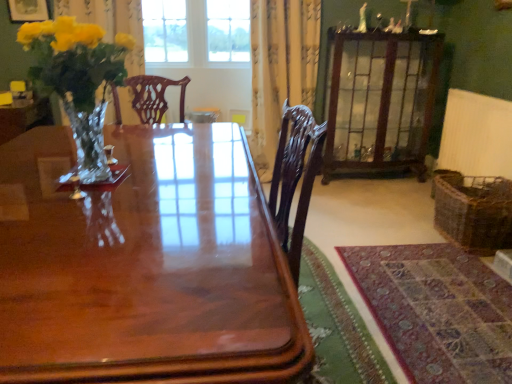
Where is `vacant area situated below shiny glass vase with yellow flowers at left (from a real-world perspective)`? vacant area situated below shiny glass vase with yellow flowers at left (from a real-world perspective) is located at coordinates (92, 179).